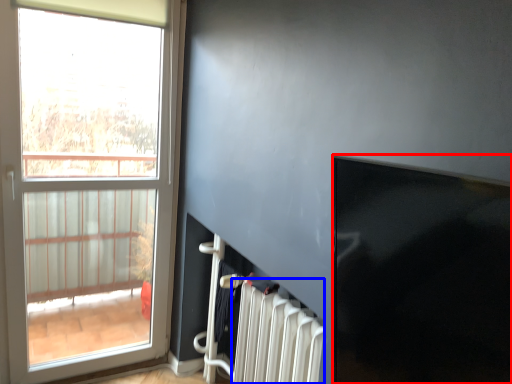
Question: Which of the following is the farthest to the observer, window screen (highlighted by a red box) or radiator (highlighted by a blue box)?

Choices:
 (A) window screen
 (B) radiator

Answer: (B)